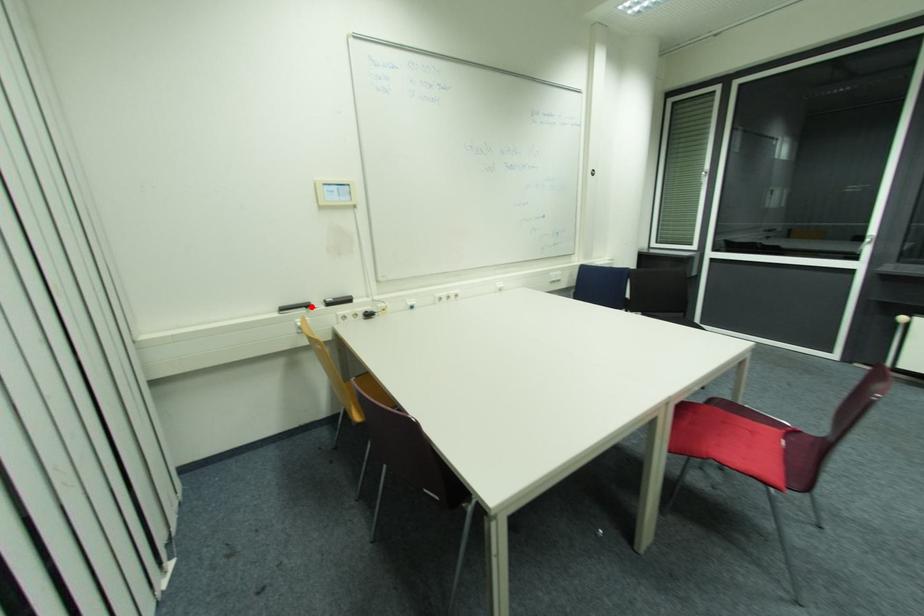
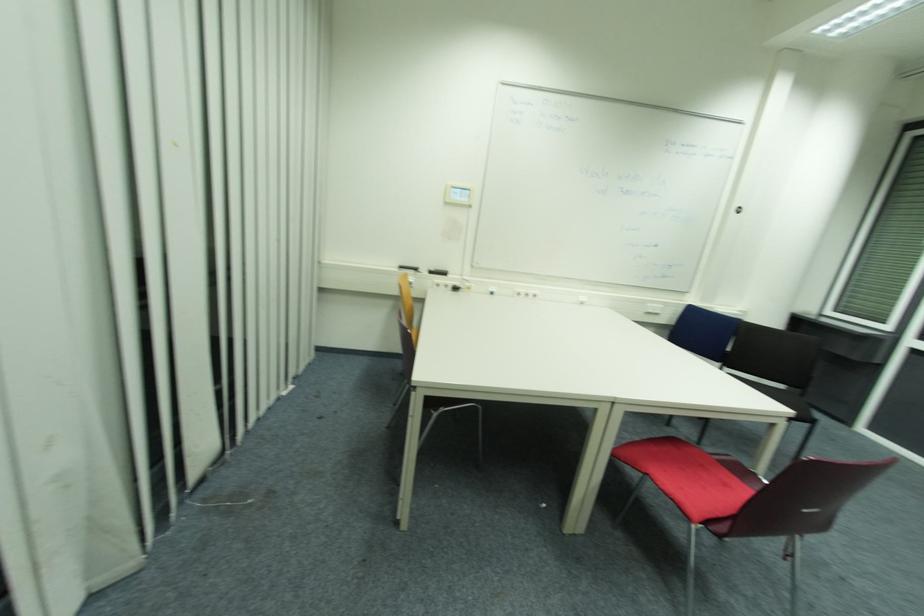
Where in the second image is the point corresponding to the highlighted location from the first image?

(419, 270)